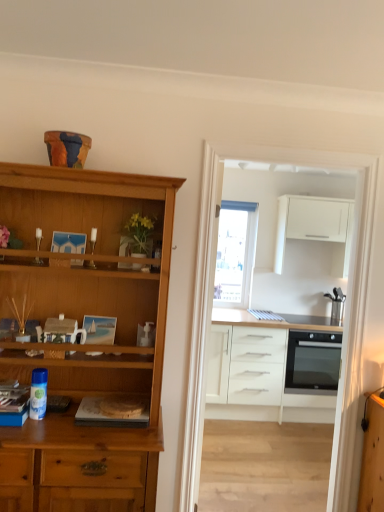
Locate an element on the screen. Image resolution: width=384 pixels, height=512 pixels. free space above white glossy cabinets at center (from a real-world perspective) is located at coordinates (288, 139).